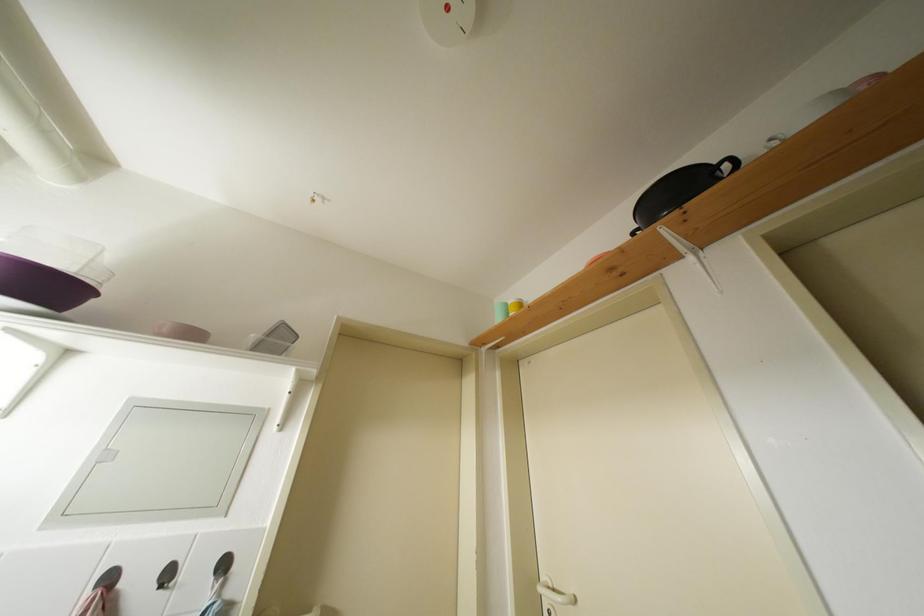
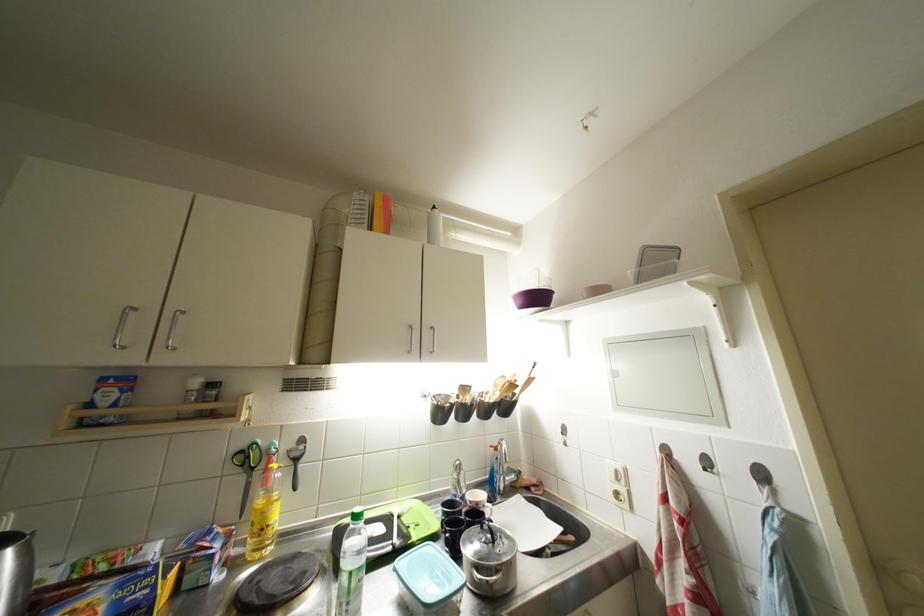
Find the pixel in the second image that matches point (175, 580) in the first image.

(714, 467)